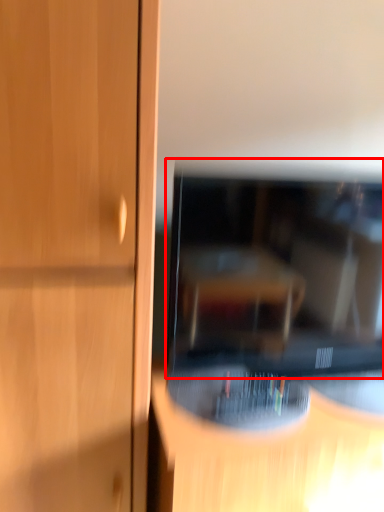
Question: From the image's perspective, what is the correct spatial positioning of television (annotated by the red box) in reference to furniture?

Choices:
 (A) below
 (B) above

Answer: (B)